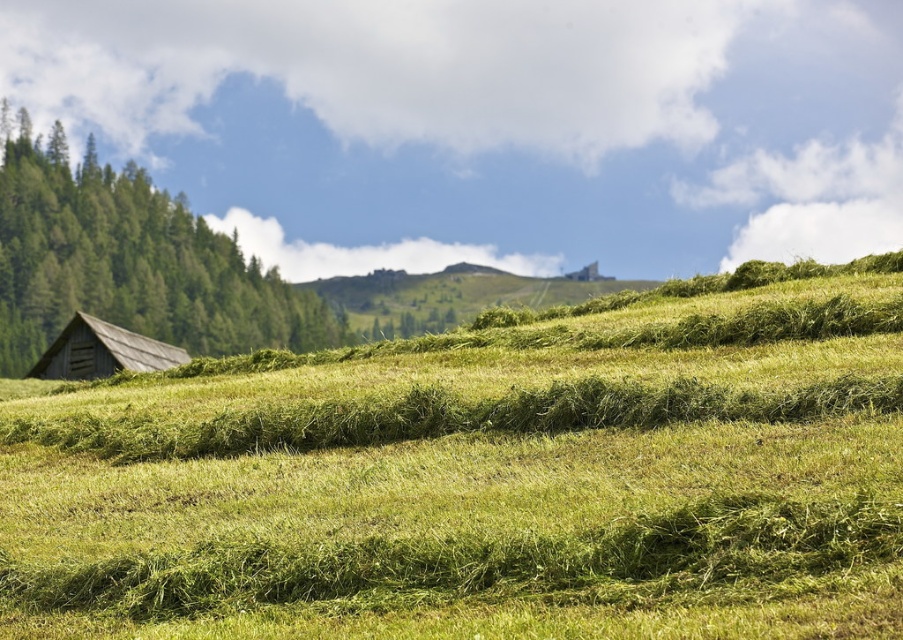
Does green grassy field at center appear under green matte tree at left?

Yes, green grassy field at center is below green matte tree at left.

The width and height of the screenshot is (903, 640). Find the location of `green grassy field at center`. green grassy field at center is located at coordinates (481, 481).

Is green grassy field at center to the left of wooden barn at lower left from the viewer's perspective?

No, green grassy field at center is not to the left of wooden barn at lower left.

Does green grassy field at center appear on the right side of wooden barn at lower left?

Indeed, green grassy field at center is positioned on the right side of wooden barn at lower left.

The image size is (903, 640). What do you see at coordinates (481, 481) in the screenshot? I see `green grassy field at center` at bounding box center [481, 481].

Where is `green grassy field at center`? This screenshot has width=903, height=640. green grassy field at center is located at coordinates (481, 481).

Does green matte tree at left have a smaller size compared to wooden barn at lower left?

Actually, green matte tree at left might be larger than wooden barn at lower left.

Can you confirm if green matte tree at left is shorter than wooden barn at lower left?

In fact, green matte tree at left may be taller than wooden barn at lower left.

Is point (24, 202) less distant than point (135, 355)?

No, it is not.

Find the location of a particular element. The image size is (903, 640). green matte tree at left is located at coordinates (129, 260).